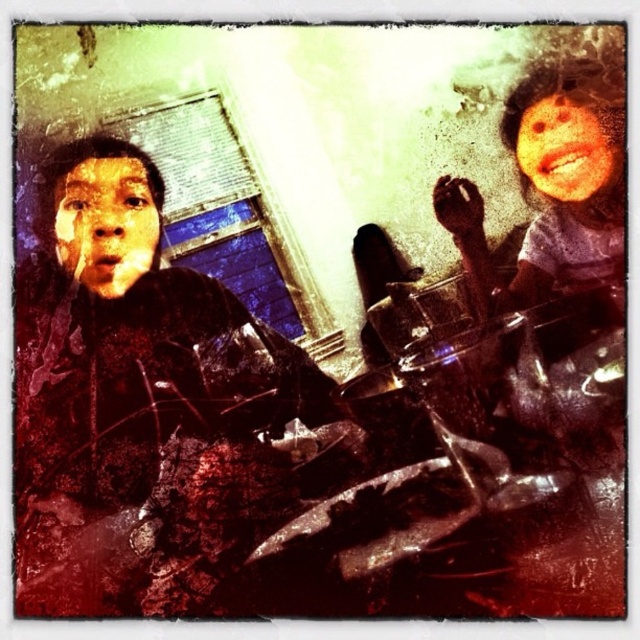
Who is lower down, matte black face at left or smooth skin face at upper right?

matte black face at left

Does matte black face at left come in front of smooth skin face at upper right?

Yes.

Where is `matte black face at left`? The width and height of the screenshot is (640, 640). matte black face at left is located at coordinates (106, 224).

Is point (35, 481) positioned before point (560, 100)?

Yes, it is.

Does matte black jacket at left have a smaller size compared to smooth skin face at upper right?

No, matte black jacket at left is not smaller than smooth skin face at upper right.

The image size is (640, 640). I want to click on matte black jacket at left, so click(x=152, y=400).

Is matte plastic girl at upper right above matte black face at left?

Correct, matte plastic girl at upper right is located above matte black face at left.

Is point (461, 260) positioned in front of point (125, 163)?

No, (461, 260) is further to viewer.

Locate an element on the screen. matte plastic girl at upper right is located at coordinates (550, 186).